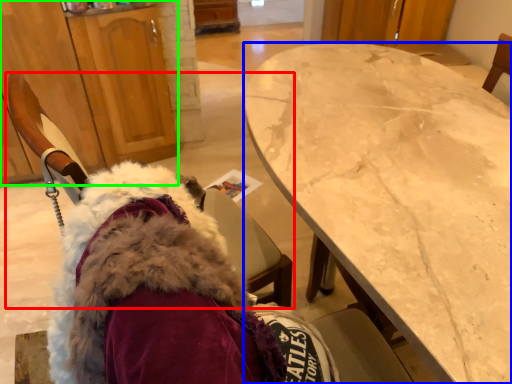
Question: Which object is the closest to the chair (highlighted by a red box)? Choose among these: desk (highlighted by a blue box) or cabinetry (highlighted by a green box).

Choices:
 (A) desk
 (B) cabinetry

Answer: (A)